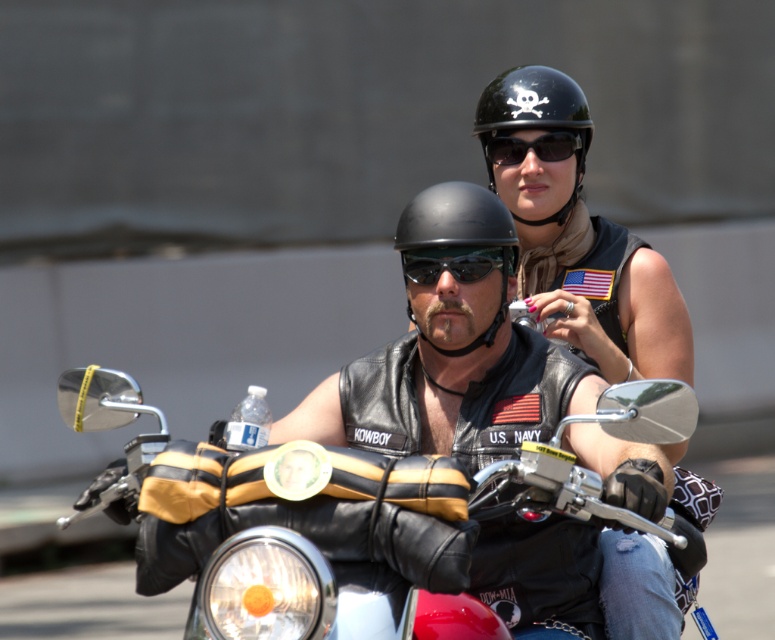
You are a photographer trying to capture a closeup of the black matte helmet at center and the black matte sunglasses at center. What is the minimum distance you need to set your camera lens to focus on both objects simultaneously?

The minimum distance your camera lens needs to focus on both the black matte helmet at center and the black matte sunglasses at center simultaneously is 8.21 inches, as that is the distance between them.

You are a photographer trying to capture a clear shot of the black leather motorcycle at center and the black matte sunglasses at center. Since the motorcycle is blocking the view of the sunglasses, can you move to the right to get both in frame?

The black leather motorcycle at center is to the left of black matte sunglasses at center, so moving to the right would place the motorcycle between you and the sunglasses, making it harder to see. Instead, moving to the left would allow you to see both objects without obstruction.

You are a photographer trying to capture a clear shot of the black matte helmet at center and the black matte sunglasses at center. Since you want to ensure both are in focus, you need to know their relative sizes. Which object is wider?

The black matte helmet at center might be wider than black matte sunglasses at center according to the description. So the helmet is likely wider.